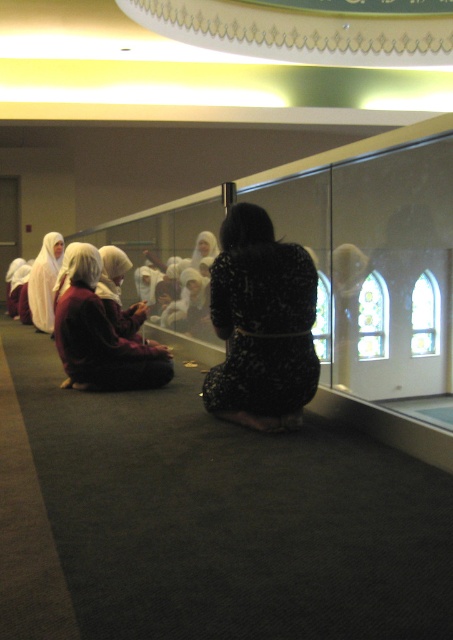
Question: Estimate the real-world distances between objects in this image. Which object is farther from the dark brown fabric hijab at lower left?

Choices:
 (A) black textured dress at center
 (B) white matte hijab at left

Answer: (B)

Question: Does dark brown fabric hijab at lower left have a smaller size compared to white matte hijab at left?

Choices:
 (A) yes
 (B) no

Answer: (A)

Question: Which of these objects is positioned closest to the dark brown fabric hijab at lower left?

Choices:
 (A) white matte hijab at left
 (B) black textured dress at center

Answer: (B)

Question: Estimate the real-world distances between objects in this image. Which object is closer to the black textured dress at center?

Choices:
 (A) dark brown fabric hijab at lower left
 (B) white matte hijab at left

Answer: (A)

Question: Is black textured dress at center closer to the viewer compared to dark brown fabric hijab at lower left?

Choices:
 (A) yes
 (B) no

Answer: (A)

Question: Does black textured dress at center appear on the left side of dark brown fabric hijab at lower left?

Choices:
 (A) yes
 (B) no

Answer: (B)